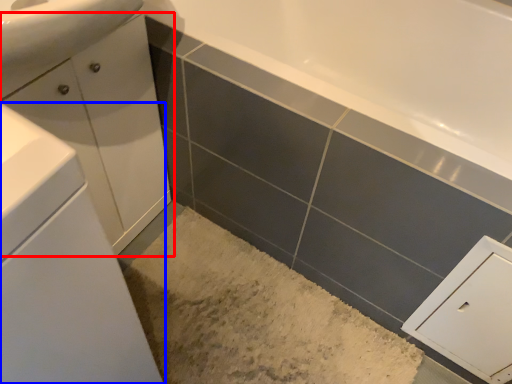
Question: Among these objects, which one is farthest to the camera, bathroom cabinet (highlighted by a red box) or bathroom cabinet (highlighted by a blue box)?

Choices:
 (A) bathroom cabinet
 (B) bathroom cabinet

Answer: (A)